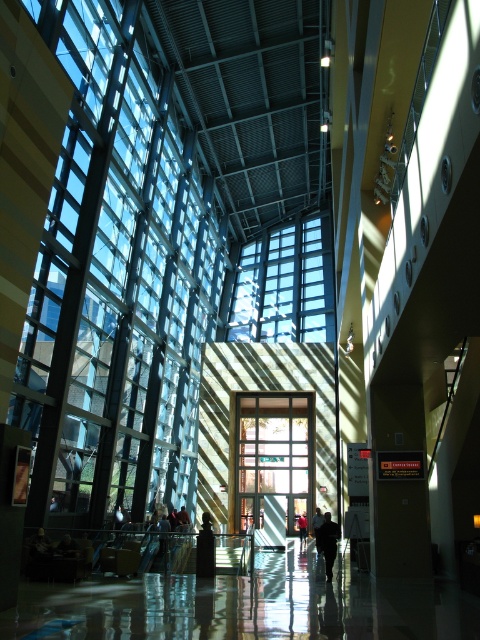
You are standing in the modern building and want to move from the point at coordinates (316, 552) to the point at coordinates (305, 516). Since you can only move forward, will you be able to reach the second point without turning around?

Yes, you can reach the point at coordinates (305, 516) because point (316, 552) is in front of it, meaning you can move directly towards it without needing to turn around.

You are standing in the modern building and see the dark gray jacket at center and the dark blue shirt at center. Which one is nearer to you?

The dark gray jacket at center is closer to the viewer than the dark blue shirt at center.

You are standing in the modern building and want to determine the distance between two points marked in the image. The points are labeled as point 1 at coordinates point (325, 518) and point 2 at coordinates point (303, 532). Given that point 1 is closer to you than point 2, which point would you physically reach first if you were to walk directly towards them?

You would reach point 1 at coordinates point (325, 518) first because it is closer to you than point 2 at coordinates point (303, 532).